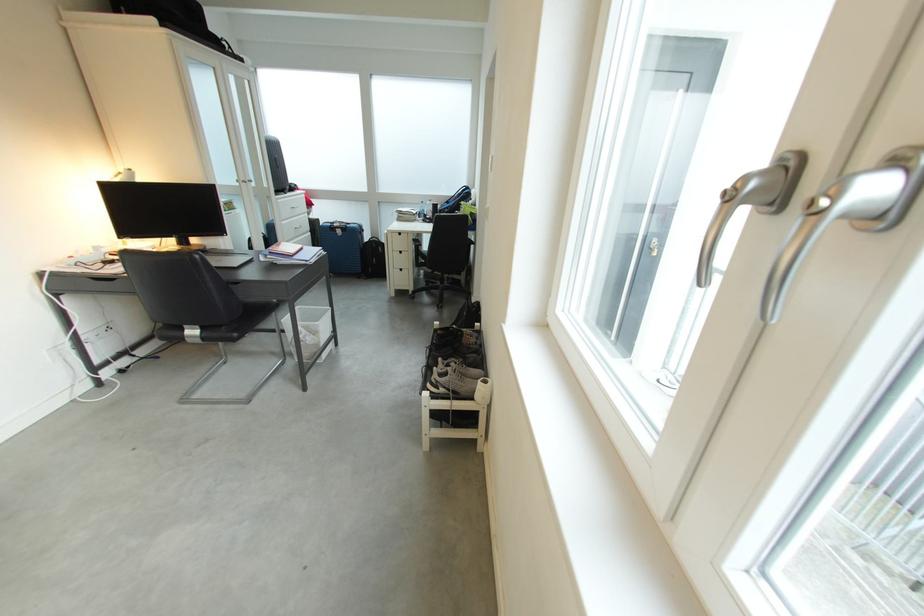
Find the location of a particular element. black backpack is located at coordinates click(x=372, y=257).